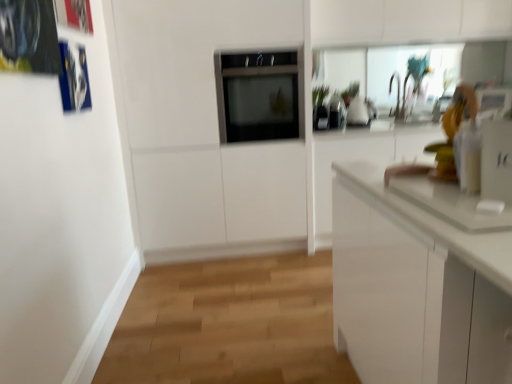
Question: Would you say satin black oven at center is inside or outside white glossy soap dispenser at right?

Choices:
 (A) inside
 (B) outside

Answer: (B)

Question: Is satin black oven at center in front of or behind white glossy soap dispenser at right in the image?

Choices:
 (A) front
 (B) behind

Answer: (B)

Question: From a real-world perspective, is satin black oven at center positioned above or below white glossy soap dispenser at right?

Choices:
 (A) below
 (B) above

Answer: (B)

Question: In terms of height, does white glossy soap dispenser at right look taller or shorter compared to satin black oven at center?

Choices:
 (A) short
 (B) tall

Answer: (A)

Question: Considering the relative positions of white glossy soap dispenser at right and satin black oven at center in the image provided, is white glossy soap dispenser at right to the left or to the right of satin black oven at center?

Choices:
 (A) right
 (B) left

Answer: (A)

Question: Is white glossy soap dispenser at right wider or thinner than satin black oven at center?

Choices:
 (A) thin
 (B) wide

Answer: (A)

Question: From the image's perspective, is white glossy soap dispenser at right above or below satin black oven at center?

Choices:
 (A) below
 (B) above

Answer: (A)